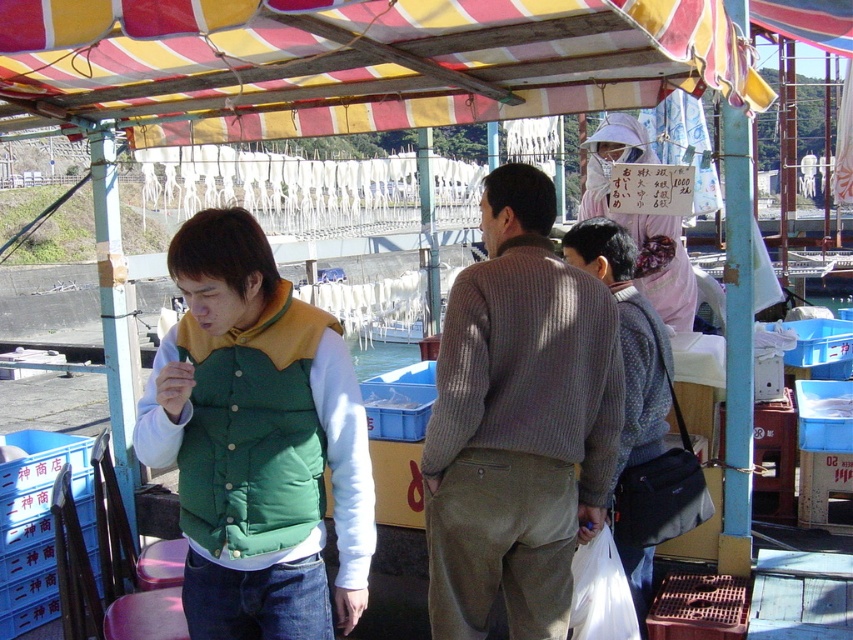
Locate an element on the screen. The width and height of the screenshot is (853, 640). knitted sweater at center is located at coordinates (518, 422).

Does knitted sweater at center appear under pink fabric sign at upper center?

Yes.

Who is more distant from viewer, (585, 532) or (682, 289)?

The point (682, 289) is behind.

Where is `knitted sweater at center`? The width and height of the screenshot is (853, 640). knitted sweater at center is located at coordinates (518, 422).

This screenshot has width=853, height=640. What do you see at coordinates (257, 442) in the screenshot?
I see `green puffer vest at center` at bounding box center [257, 442].

This screenshot has height=640, width=853. Identify the location of green puffer vest at center. (257, 442).

Which is more to the left, green puffer vest at center or green puffy vest at center?

Positioned to the left is green puffer vest at center.

Between point (233, 324) and point (292, 371), which one is positioned behind?

Positioned behind is point (292, 371).

Identify the location of green puffer vest at center. The image size is (853, 640). (257, 442).